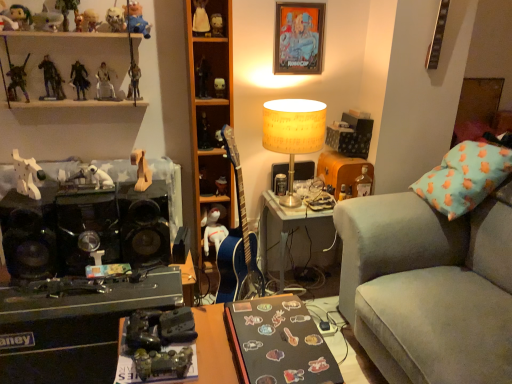
You are a GUI agent. You are given a task and a screenshot of the screen. Output one action in this format:
    pyautogui.click(x=<x>, y=<y>)
    Task: Click on the free point below yellow paper lampshade at upper right (from a real-world perspective)
    The height and width of the screenshot is (384, 512).
    Given the screenshot: What is the action you would take?
    pyautogui.click(x=295, y=200)